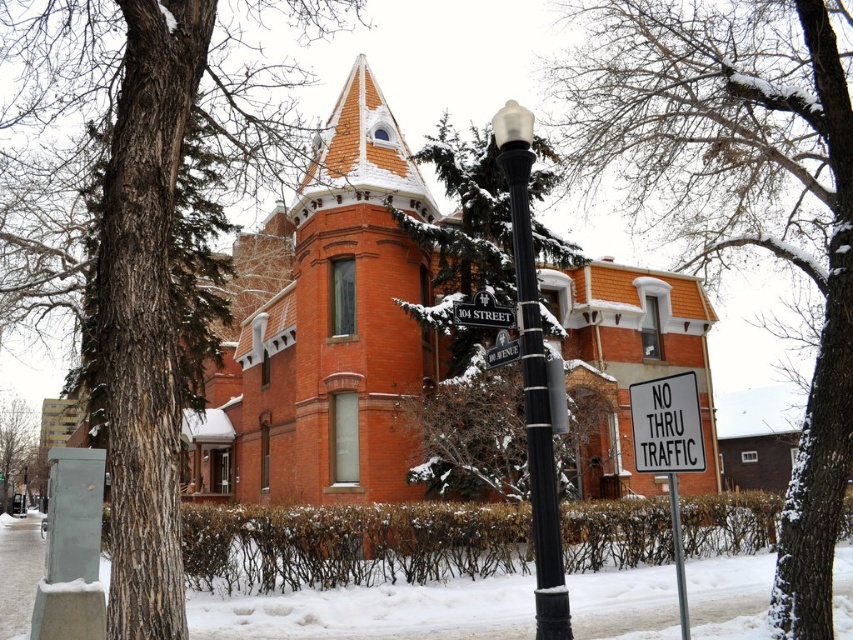
Question: Which point appears farthest from the camera in this image?

Choices:
 (A) (4, 468)
 (B) (679, 556)

Answer: (A)

Question: Estimate the real-world distances between objects in this image. Which object is closer to the metallic street sign at center?

Choices:
 (A) metallic pole at lower right
 (B) brown bark tree at lower left

Answer: (A)

Question: Is brown bark tree at lower left thinner than metallic silver street sign at center?

Choices:
 (A) no
 (B) yes

Answer: (A)

Question: Is the position of brown rough bark tree at left less distant than that of smooth bark tree at upper left?

Choices:
 (A) yes
 (B) no

Answer: (A)

Question: Is brown bark tree at lower left behind metallic pole at lower right?

Choices:
 (A) yes
 (B) no

Answer: (A)

Question: Which point is farther to the camera?

Choices:
 (A) metallic pole at lower right
 (B) white plastic sign at lower right

Answer: (A)